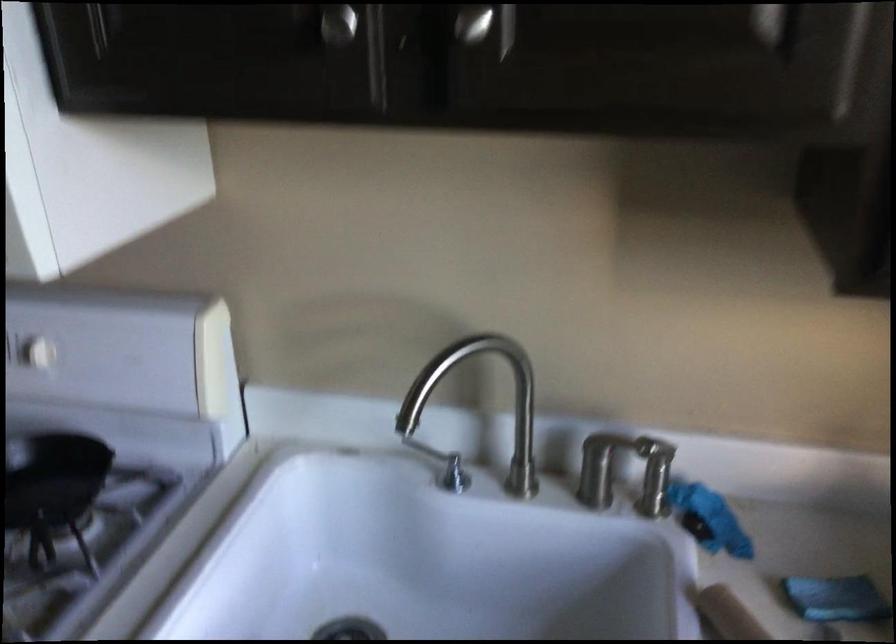
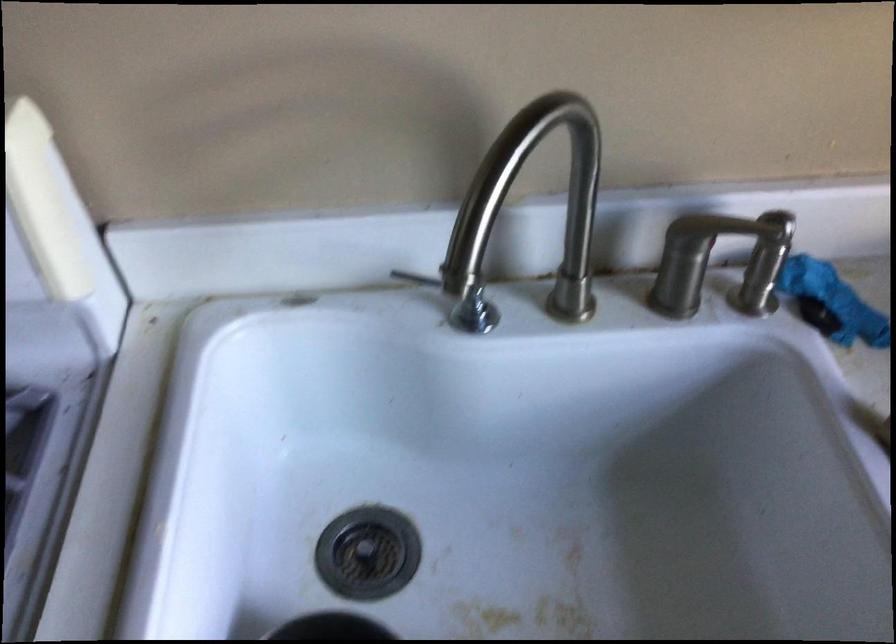
Question: How did the camera likely rotate?

Choices:
 (A) Left
 (B) Right
 (C) Up
 (D) Down

Answer: (D)